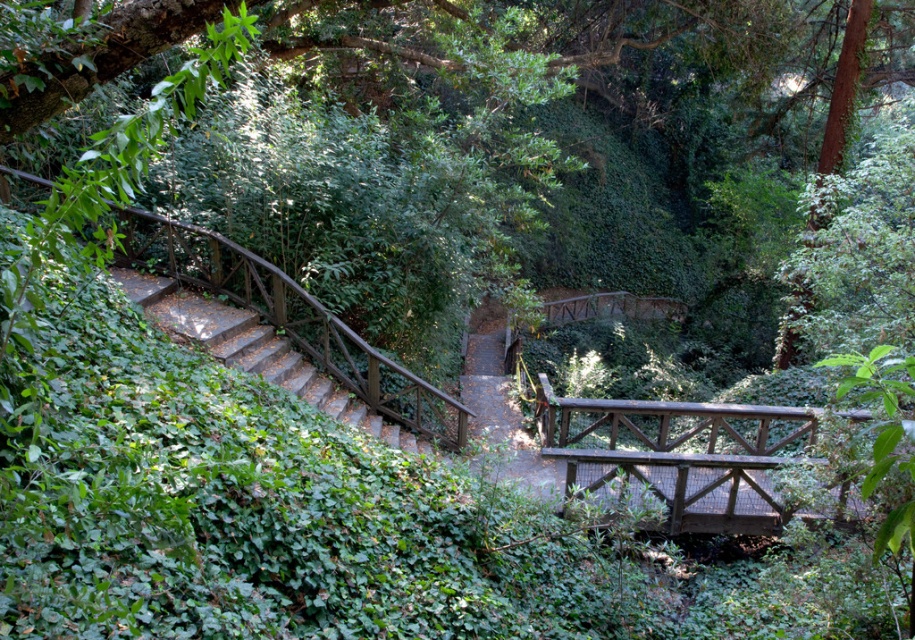
You are standing at the base of the wooden staircase and want to take a photo of the wooden bridge at center. If your camera can focus on objects up to 20 feet away, will you need to move closer to capture a clear image?

The wooden bridge at center and camera are 21.85 feet apart, which exceeds the camera focus range of 20 feet. Therefore, you need to move closer to ensure the wooden bridge at center is within the camera focus range.

You are a hiker carrying a heavy backpack and need to cross either the wooden bridge at center or the wooden stairs at left. Which structure would allow you to maintain a lower center of gravity for better balance?

The wooden bridge at center has a lesser height compared to wooden stairs at left, so crossing the wooden bridge at center would allow you to maintain a lower center of gravity for better balance.

You are standing at the base of the wooden staircase and want to reach the bridge. You see two points marked in the scene, point (585, 432) and point (122, 280). Which point is closer to you as you face the staircase?

Point (122, 280) is closer to you because it is less further to the viewer than point (585, 432).